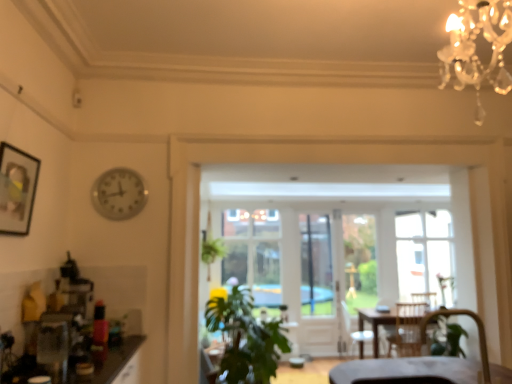
Question: Is green leafy plant at center placed right next to matte black picture frame at upper left?

Choices:
 (A) yes
 (B) no

Answer: (B)

Question: Could you tell me if green leafy plant at center is turned towards matte black picture frame at upper left?

Choices:
 (A) no
 (B) yes

Answer: (A)

Question: Is green leafy plant at center outside of matte black picture frame at upper left?

Choices:
 (A) no
 (B) yes

Answer: (B)

Question: From a real-world perspective, is green leafy plant at center located higher than matte black picture frame at upper left?

Choices:
 (A) yes
 (B) no

Answer: (B)

Question: Is green leafy plant at center to the right of matte black picture frame at upper left from the viewer's perspective?

Choices:
 (A) no
 (B) yes

Answer: (B)

Question: Does green leafy plant at center have a larger size compared to matte black picture frame at upper left?

Choices:
 (A) yes
 (B) no

Answer: (A)

Question: From the image's perspective, is metallic clock at upper left under clear glass window at center?

Choices:
 (A) yes
 (B) no

Answer: (B)

Question: From a real-world perspective, is metallic clock at upper left under clear glass window at center?

Choices:
 (A) no
 (B) yes

Answer: (A)

Question: Is clear glass window at center a part of metallic clock at upper left?

Choices:
 (A) no
 (B) yes

Answer: (A)

Question: Is metallic clock at upper left bigger than clear glass window at center?

Choices:
 (A) no
 (B) yes

Answer: (A)

Question: Does metallic clock at upper left appear on the left side of clear glass window at center?

Choices:
 (A) no
 (B) yes

Answer: (B)

Question: Does metallic clock at upper left have a greater height compared to clear glass window at center?

Choices:
 (A) no
 (B) yes

Answer: (A)

Question: Can you see matte black picture frame at upper left touching metallic clock at upper left?

Choices:
 (A) no
 (B) yes

Answer: (A)